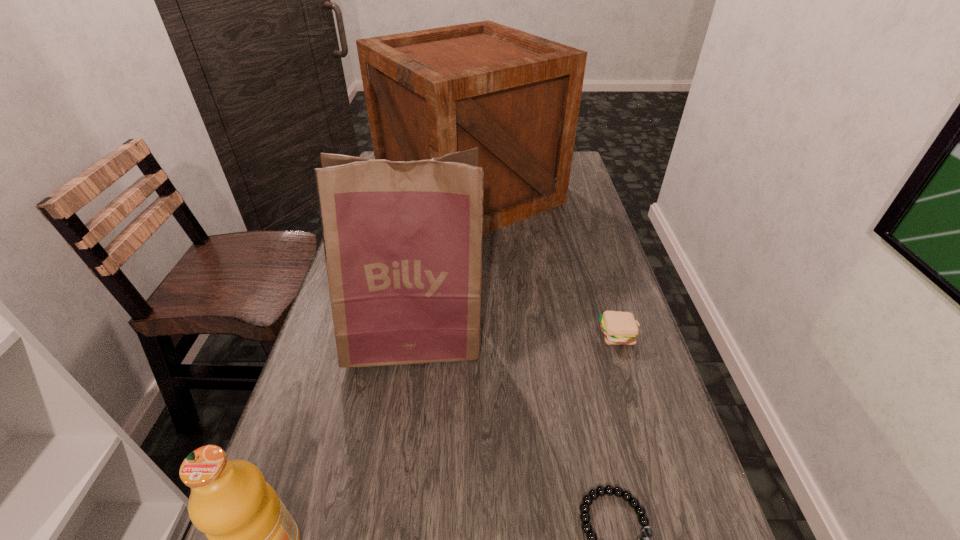
Locate an element on the screen. The width and height of the screenshot is (960, 540). box is located at coordinates (516, 96).

The image size is (960, 540). In order to click on grocery bag in this screenshot , I will do `click(403, 240)`.

What are the coordinates of `patty` in the screenshot? It's located at (619, 328).

Where is `free spot located 0.340m on the front of the farthest object`? The image size is (960, 540). free spot located 0.340m on the front of the farthest object is located at coordinates (465, 341).

Find the location of a particular element. vacant area situated 0.140m on the front-facing side of the grocery bag is located at coordinates (399, 437).

The image size is (960, 540). I want to click on free location located on the back of the fourth tallest object, so click(591, 248).

Image resolution: width=960 pixels, height=540 pixels. In order to click on object that is at the far edge in this screenshot , I will do `click(516, 96)`.

Image resolution: width=960 pixels, height=540 pixels. I want to click on box present at the left edge, so [x=516, y=96].

Identify the location of grocery bag positioned at the left edge. (403, 240).

Where is `box at the right edge`? box at the right edge is located at coordinates (516, 96).